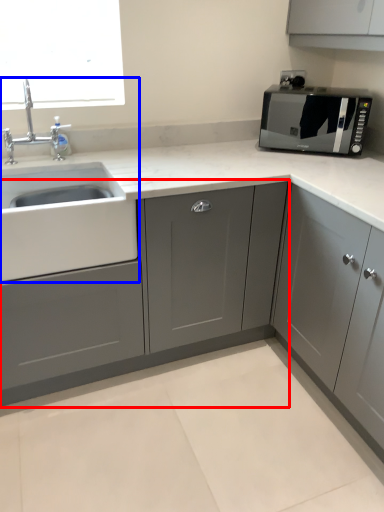
Question: Among these objects, which one is nearest to the camera, cabinetry (highlighted by a red box) or sink (highlighted by a blue box)?

Choices:
 (A) cabinetry
 (B) sink

Answer: (A)